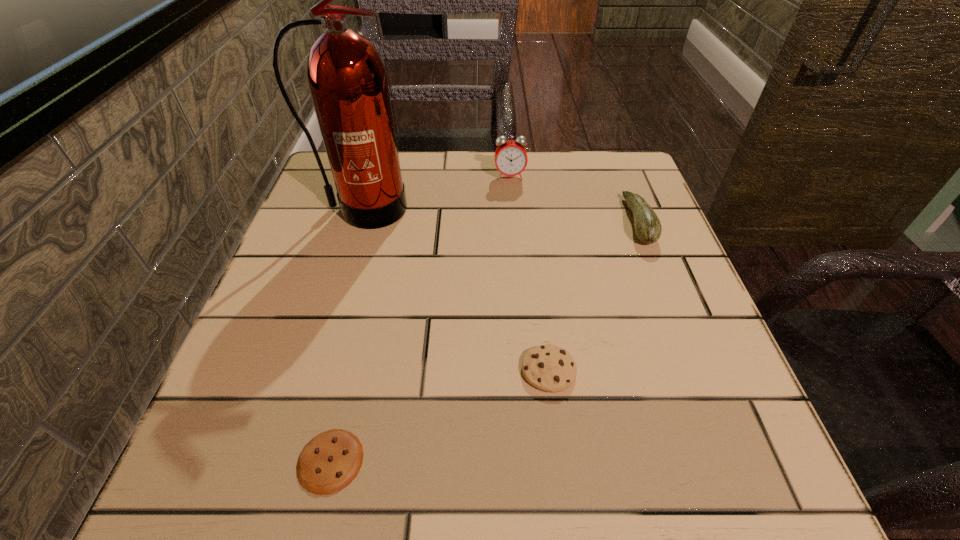
You are a GUI agent. You are given a task and a screenshot of the screen. Output one action in this format:
    pyautogui.click(x=<x>, y=<y>)
    Task: Click on the free space between the tallest object and the zucchini
    This screenshot has height=540, width=960.
    Given the screenshot: What is the action you would take?
    pyautogui.click(x=500, y=215)

Find the location of a particular element. The height and width of the screenshot is (540, 960). vacant area that lies between the fourth farthest object and the tallest object is located at coordinates pos(456,290).

You are a GUI agent. You are given a task and a screenshot of the screen. Output one action in this format:
    pyautogui.click(x=<x>, y=<y>)
    Task: Click on the object that is the third closest to the alarm clock
    This screenshot has height=540, width=960.
    Given the screenshot: What is the action you would take?
    pyautogui.click(x=550, y=368)

The height and width of the screenshot is (540, 960). In order to click on object that is the third closest to the nearer cookie in this screenshot , I will do `click(648, 228)`.

This screenshot has width=960, height=540. I want to click on vacant region that satisfies the following two spatial constraints: 1. on the front-facing side of the farthest object; 2. on the left side of the right cookie, so click(x=526, y=370).

In order to click on free location that satisfies the following two spatial constraints: 1. on the front-facing side of the nearer cookie; 2. on the right side of the fire extinguisher in this screenshot , I will do `click(286, 461)`.